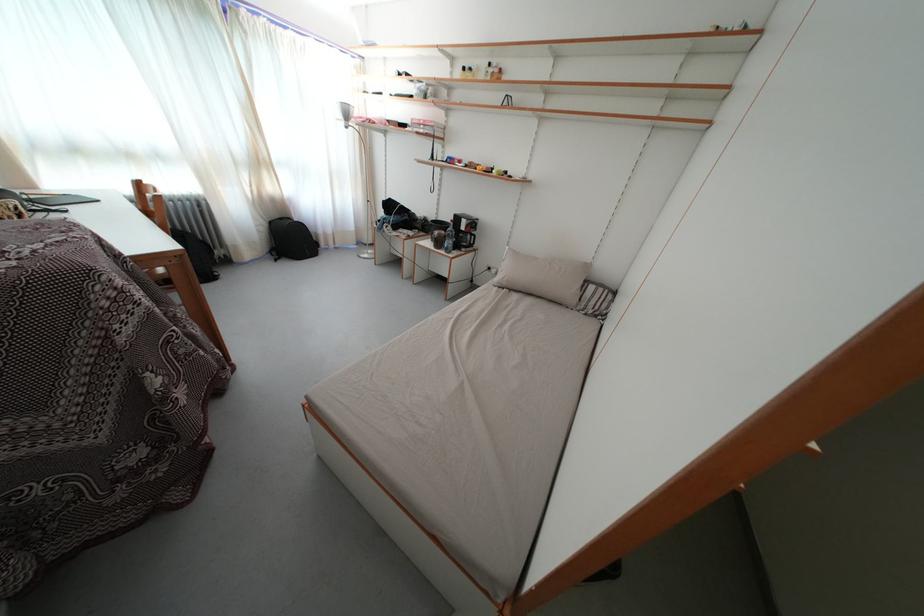
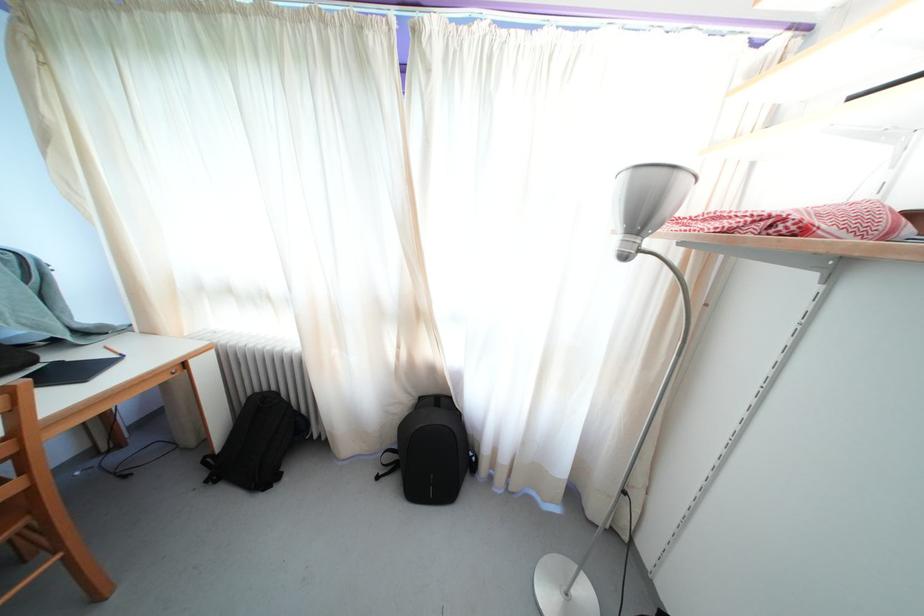
In the second image, find the point that corresponds to the point at 353,122 in the first image.

(648, 223)